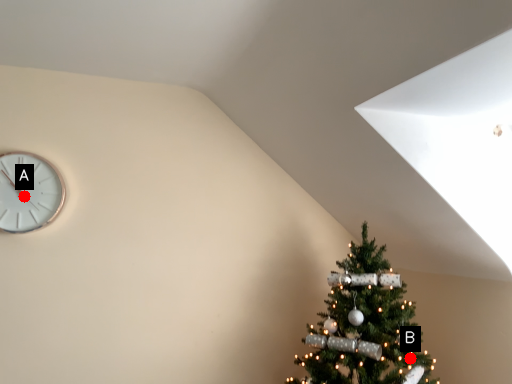
Question: Two points are circled on the image, labeled by A and B beside each circle. Which point is closer to the camera?

Choices:
 (A) A is closer
 (B) B is closer

Answer: (B)